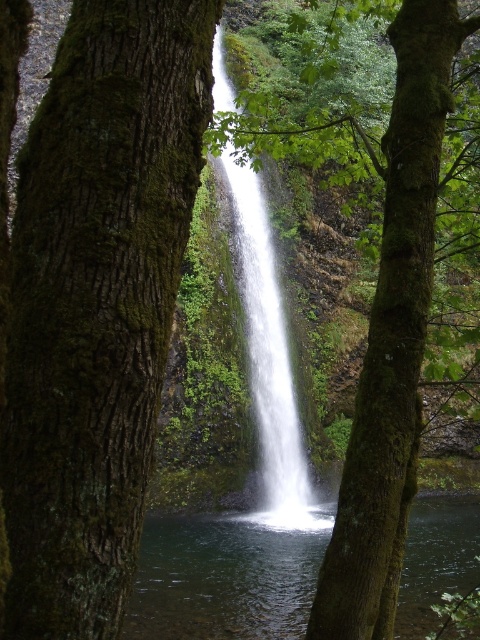
Question: Observing the image, what is the correct spatial positioning of white glossy waterfall at center in reference to green mossy tree at center?

Choices:
 (A) below
 (B) above

Answer: (B)

Question: Which object is positioned closest to the green mossy bark tree at center?

Choices:
 (A) white glossy waterfall at center
 (B) clear water at center
 (C) green mossy tree at center

Answer: (C)

Question: Which object appears closest to the camera in this image?

Choices:
 (A) green mossy bark tree at center
 (B) green mossy tree at center
 (C) white glossy waterfall at center
 (D) clear water at center

Answer: (A)

Question: Does clear water at center appear on the left side of green mossy tree at center?

Choices:
 (A) no
 (B) yes

Answer: (A)

Question: Can you confirm if green mossy bark tree at center is wider than green mossy tree at center?

Choices:
 (A) yes
 (B) no

Answer: (B)

Question: Which object appears farthest from the camera in this image?

Choices:
 (A) green mossy tree at center
 (B) green mossy bark tree at center

Answer: (A)